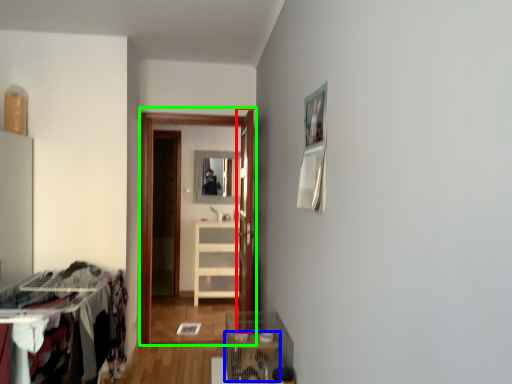
Question: Which object is positioned farthest from door (highlighted by a red box)? Select from table (highlighted by a blue box) and glass door (highlighted by a green box).

Choices:
 (A) table
 (B) glass door

Answer: (B)